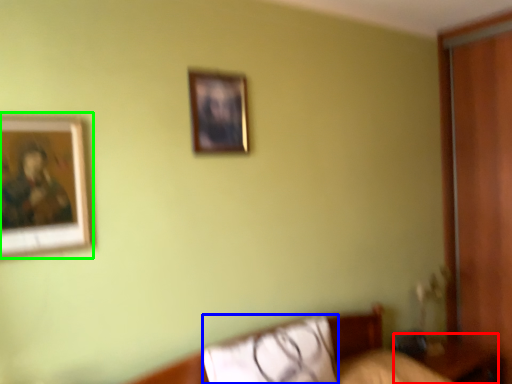
Question: Which object is the farthest from table (highlighted by a red box)? Choose among these: pillow (highlighted by a blue box) or picture frame (highlighted by a green box).

Choices:
 (A) pillow
 (B) picture frame

Answer: (B)